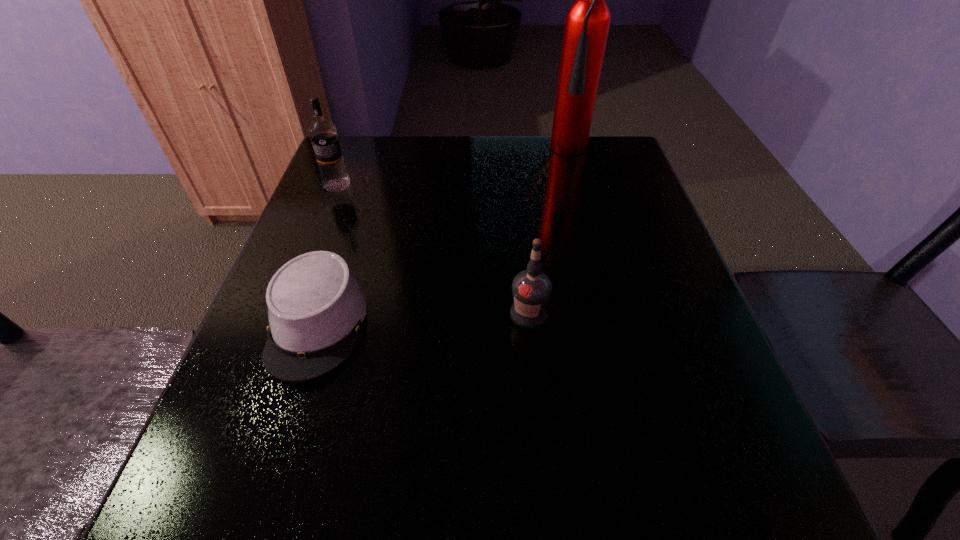
Find the location of a particular element. The image size is (960, 540). vacant space located 0.150m on the front-facing side of the shortest object is located at coordinates (266, 485).

You are a GUI agent. You are given a task and a screenshot of the screen. Output one action in this format:
    pyautogui.click(x=<x>, y=<y>)
    Task: Click on the fire extinguisher that is at the far edge
    
    Given the screenshot: What is the action you would take?
    pyautogui.click(x=587, y=22)

Find the location of a particular element. The height and width of the screenshot is (540, 960). vodka that is positioned at the far edge is located at coordinates (323, 134).

Locate an element on the screen. vodka present at the left edge is located at coordinates (323, 134).

What are the coordinates of `hat positioned at the left edge` in the screenshot? It's located at (316, 306).

You are a GUI agent. You are given a task and a screenshot of the screen. Output one action in this format:
    pyautogui.click(x=<x>, y=<y>)
    Task: Click on the object present at the right edge
    
    Given the screenshot: What is the action you would take?
    pyautogui.click(x=587, y=22)

Identify the location of object present at the far left corner. (323, 134).

Locate an element on the screen. This screenshot has width=960, height=540. object that is at the far right corner is located at coordinates (587, 22).

Find the location of a particular element. Image resolution: width=960 pixels, height=540 pixels. vacant space at the far edge of the desktop is located at coordinates (453, 154).

This screenshot has width=960, height=540. In the image, there is a desktop. Find the location of `vacant space at the left edge`. vacant space at the left edge is located at coordinates (357, 200).